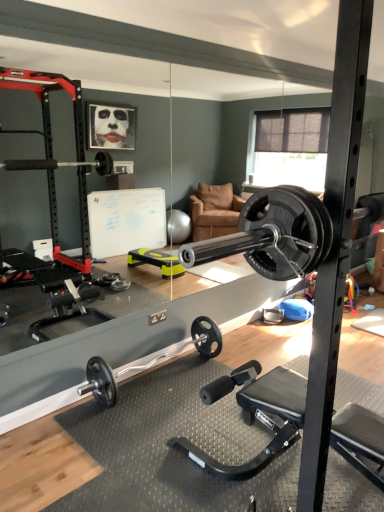
Describe the element at coordinates (148, 362) in the screenshot. I see `black rubber dumbbell at center` at that location.

Find the location of a particular element. Image resolution: width=384 pixels, height=512 pixels. black rubber dumbbell at center is located at coordinates (148, 362).

In order to face black rubber dumbbell at center, should I rotate leftwards or rightwards?

Turn left by 4.374 degrees to look at black rubber dumbbell at center.

Image resolution: width=384 pixels, height=512 pixels. Identify the location of black rubber dumbbell at center. (148, 362).